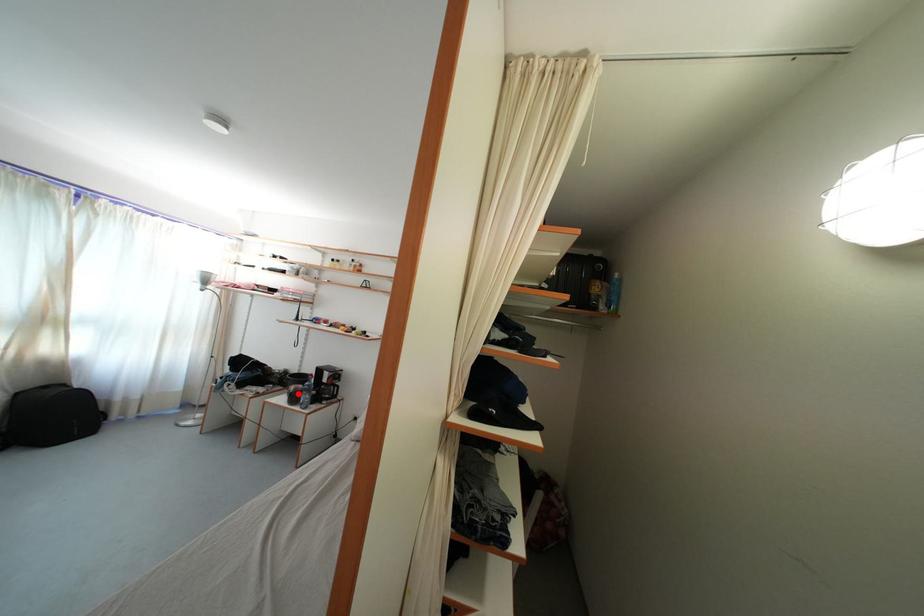
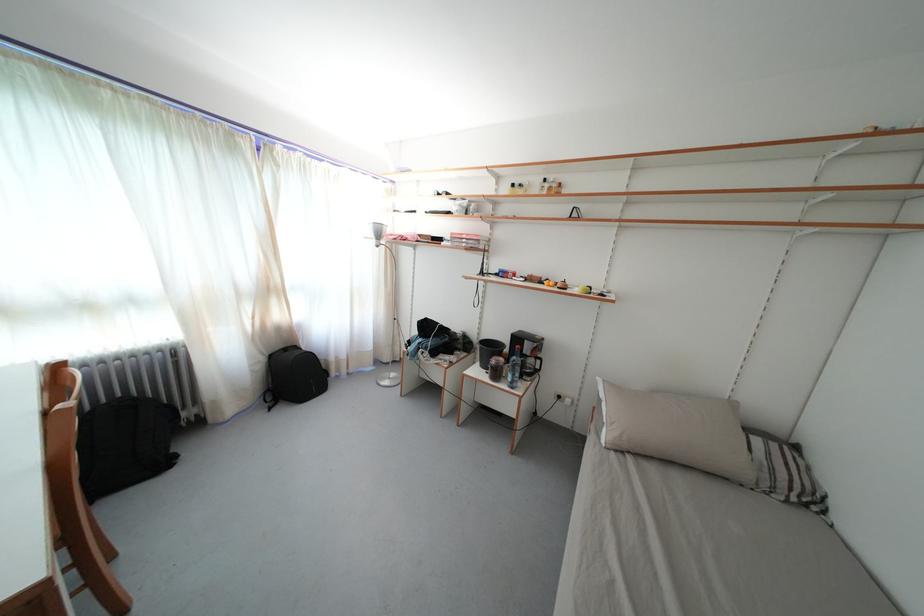
Question: I am providing you with two images of the same scene from different viewpoints. In image1, a red point is highlighted. Considering the same 3D point in image2, which of the following is correct?

Choices:
 (A) It is closer
 (B) It is farther

Answer: (A)